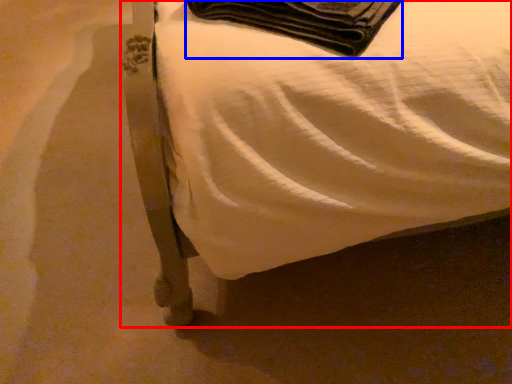
Question: Which of the following is the closest to the observer, furniture (highlighted by a red box) or blanket (highlighted by a blue box)?

Choices:
 (A) furniture
 (B) blanket

Answer: (A)